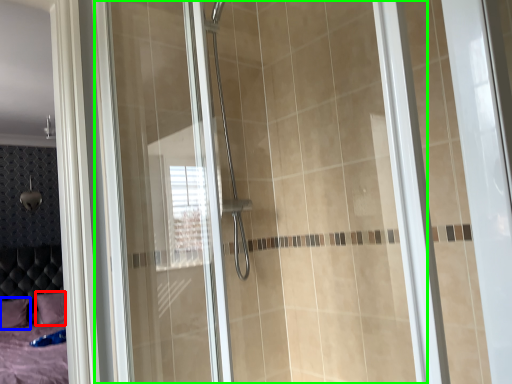
Question: Which is nearer to the pillow (highlighted by a red box)? pillow (highlighted by a blue box) or glass door (highlighted by a green box).

Choices:
 (A) pillow
 (B) glass door

Answer: (A)